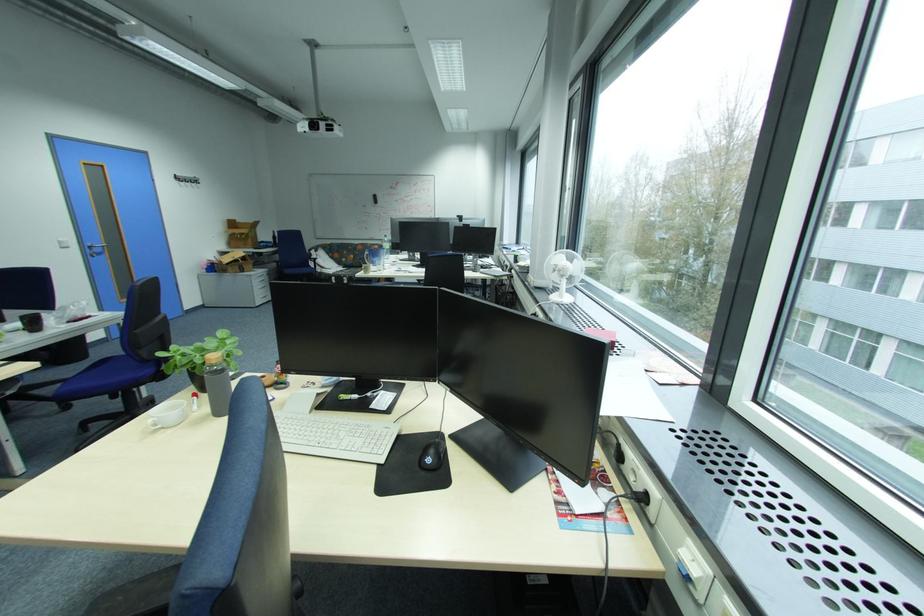
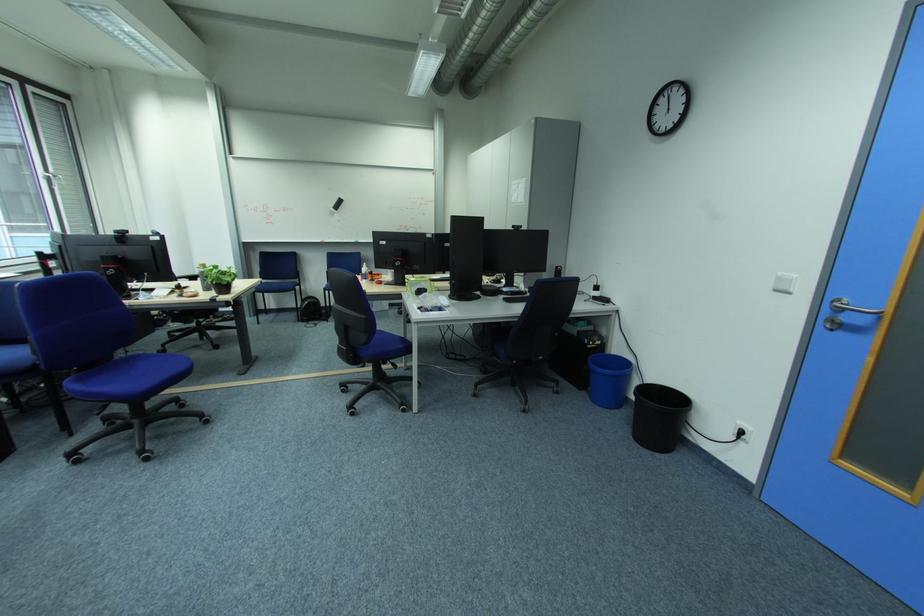
In the second image, find the point that corresponds to point (71, 249) in the first image.

(785, 292)